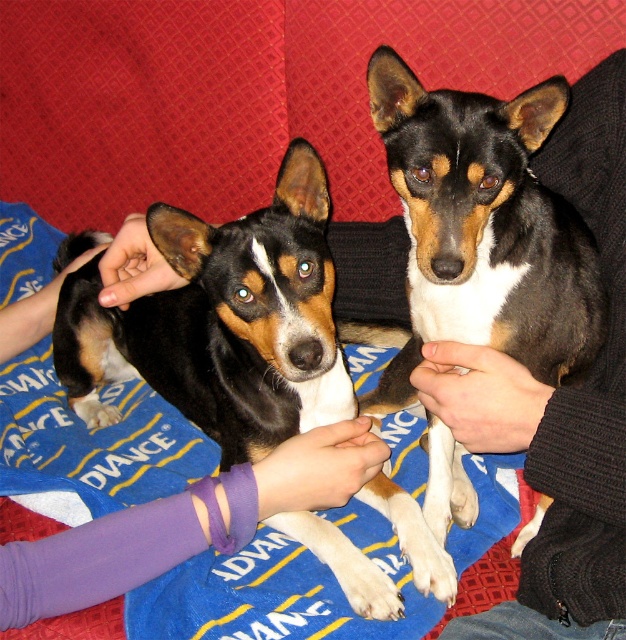
Question: Is black glossy dog at center smaller than knitted black sweater at upper center?

Choices:
 (A) no
 (B) yes

Answer: (A)

Question: Does black and tan fur at center have a greater width compared to knitted black sweater at upper center?

Choices:
 (A) yes
 (B) no

Answer: (A)

Question: Can you confirm if black glossy dog at center is thinner than knitted black sweater at upper center?

Choices:
 (A) no
 (B) yes

Answer: (A)

Question: Which object is the closest to the black glossy dog at center?

Choices:
 (A) black and tan fur at center
 (B) purple fabric wristband at lower left
 (C) knitted black sweater at upper center

Answer: (B)

Question: Which point appears closest to the camera in this image?

Choices:
 (A) (309, 506)
 (B) (516, 404)
 (C) (267, 330)

Answer: (B)

Question: Estimate the real-world distances between objects in this image. Which object is closer to the black and tan fur at center?

Choices:
 (A) knitted black sweater at upper center
 (B) black glossy dog at center
 (C) purple fabric wristband at lower left

Answer: (A)